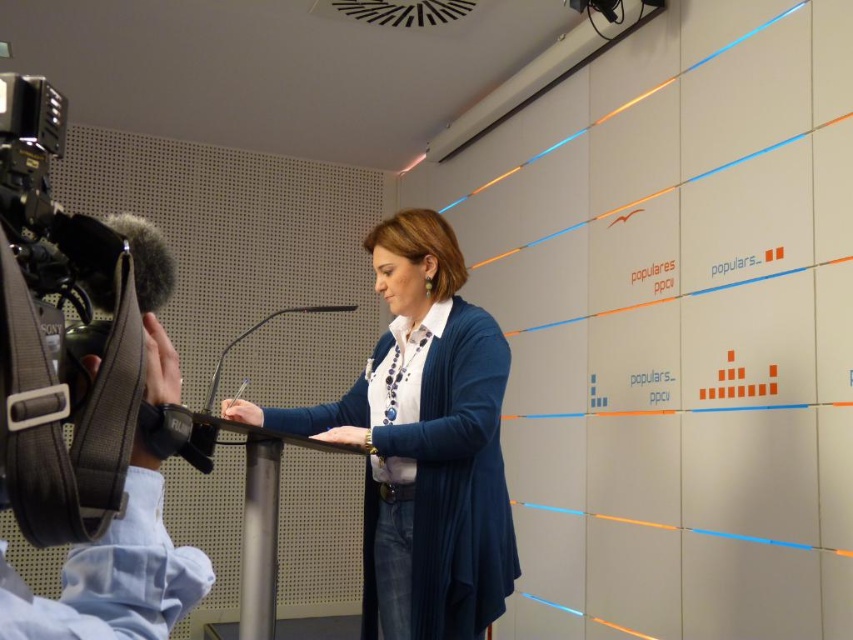
You are standing in the conference room and see two points on the wall with geometric shapes. Which point is closer to you, point (x=480, y=595) or point (x=293, y=308)?

Point (x=480, y=595) is closer to the viewer than point (x=293, y=308).

You are standing in the conference room and want to know how far the point at coordinates point (90, 634) is from you. Can you determine the distance?

The point (90, 634) is 20.43 inches from the camera, so the distance is 20.43 inches.